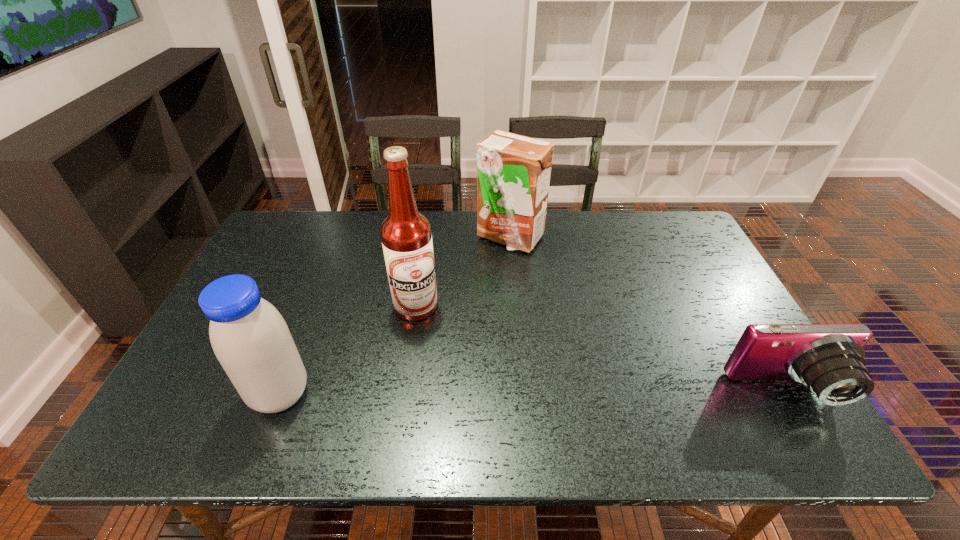
Find the location of a particular element. vacant space located 0.220m on the label side of the second farthest object is located at coordinates (484, 369).

Identify the location of vacant area situated on the straw side of the farthest object. The image size is (960, 540). (553, 332).

Find the location of a particular element. Image resolution: width=960 pixels, height=540 pixels. free space located 0.160m on the straw side of the farthest object is located at coordinates click(x=534, y=290).

Locate an element on the screen. Image resolution: width=960 pixels, height=540 pixels. vacant space located 0.180m on the straw side of the farthest object is located at coordinates (536, 295).

The image size is (960, 540). I want to click on object present at the far edge, so click(513, 171).

Identify the location of soya milk that is at the near edge. (251, 340).

The image size is (960, 540). I want to click on camera that is positioned at the near edge, so click(x=827, y=358).

At what (x,y) coordinates should I click in order to perform the action: click on object that is at the right edge. Please return your answer as a coordinate pair (x, y). This screenshot has width=960, height=540. Looking at the image, I should click on (827, 358).

Locate an element on the screen. The image size is (960, 540). object at the near right corner is located at coordinates (827, 358).

What are the coordinates of `vacant area at the far edge of the desktop` in the screenshot? It's located at (633, 222).